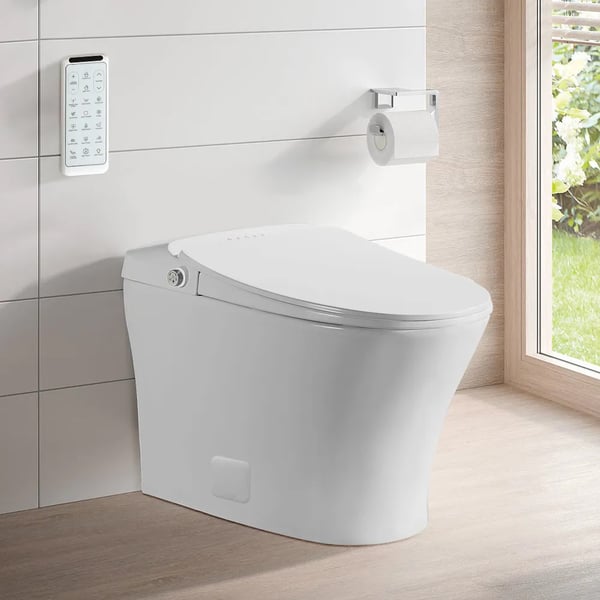
The image size is (600, 600). Identify the location of flooring. (139, 559).